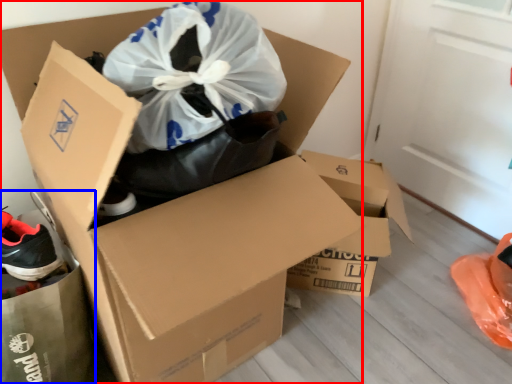
Question: Among these objects, which one is nearest to the camera, box (highlighted by a red box) or garbage (highlighted by a blue box)?

Choices:
 (A) box
 (B) garbage

Answer: (A)